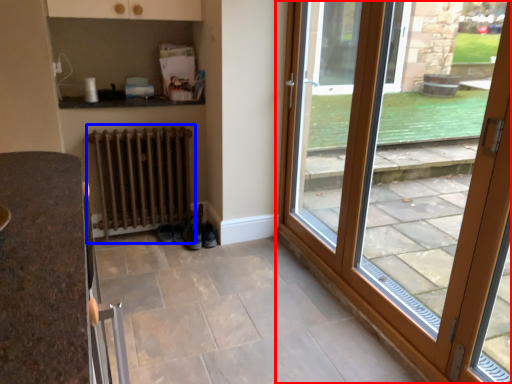
Question: Which point is further to the camera, door (highlighted by a red box) or radiator (highlighted by a blue box)?

Choices:
 (A) door
 (B) radiator

Answer: (B)